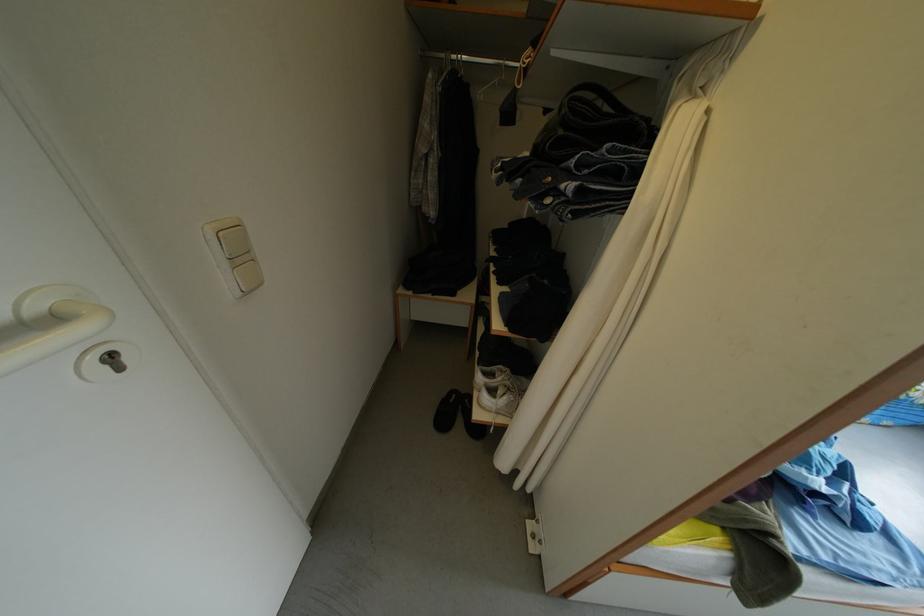
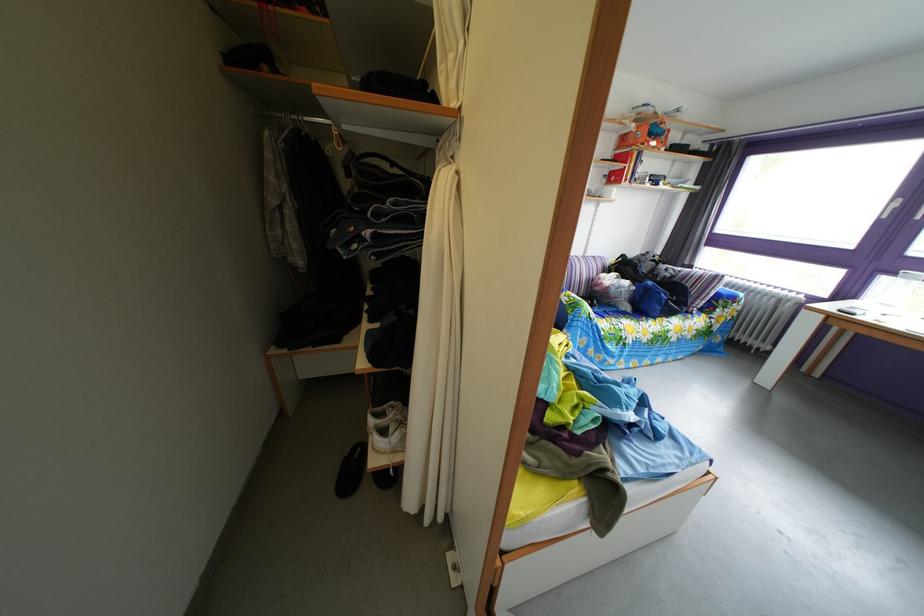
The point at (465, 65) is marked in the first image. Where is the corresponding point in the second image?

(306, 126)